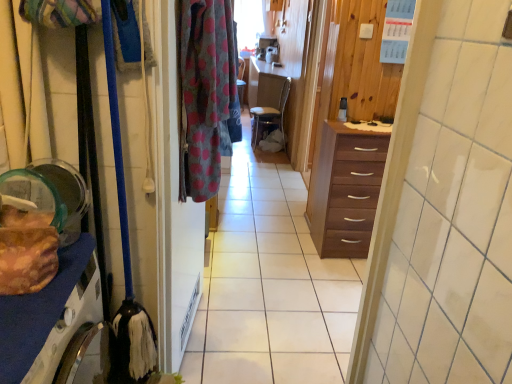
Identify the location of vacant region to the left of dark brown wood drawer at center, arranged as the 1th cabinetry when viewed from the right. The width and height of the screenshot is (512, 384). (292, 246).